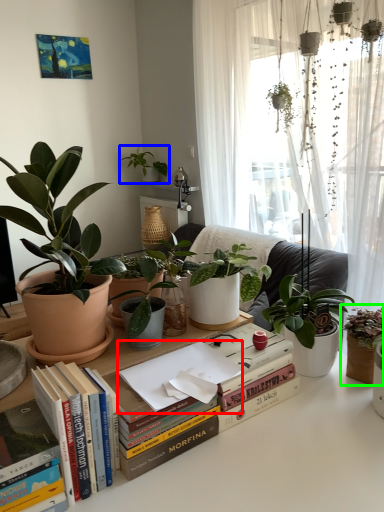
Question: Based on their relative distances, which object is nearer to paperback book (highlighted by a red box)? Choose from houseplant (highlighted by a blue box) and houseplant (highlighted by a green box).

Choices:
 (A) houseplant
 (B) houseplant

Answer: (B)